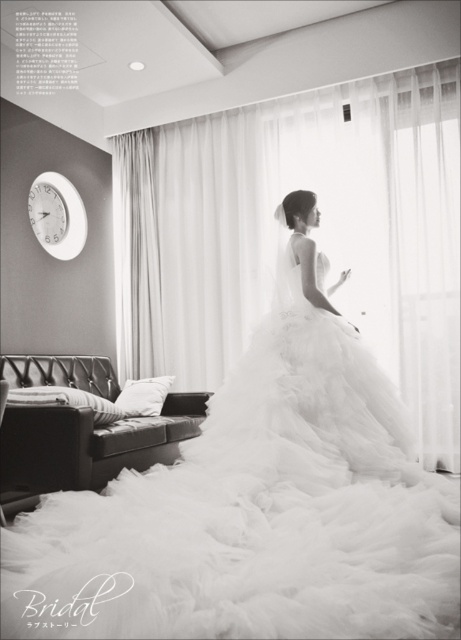
You are a photographer adjusting the lighting in the room. The main light source is positioned at point A, and you need to ensure that the white tulle dress at center is evenly lit. Given the dress is at point B, which is at coordinates 0.787, 0.562, should you move the light source closer to or farther from the dress to achieve even lighting?

The white tulle dress at center is located at point B with coordinates (x=259, y=502). To achieve even lighting, you should move the light source closer to the dress if it is currently positioned farther away, or farther away if it is too close. However, without knowing the current position of the light source relative to the dress, an exact recommendation cannot be provided.

You are a photographer standing in front of the white tulle dress at center. You want to take a closeup shot of the intricate lace details on the dress. Considering your current distance, is it possible to get a clear closeup without moving closer?

The white tulle dress at center is 1.29 meters away from the camera. To capture intricate lace details clearly, you would likely need to move closer for a sharper focus, as 1.29 meters might be too far for a closeup without specialized equipment.